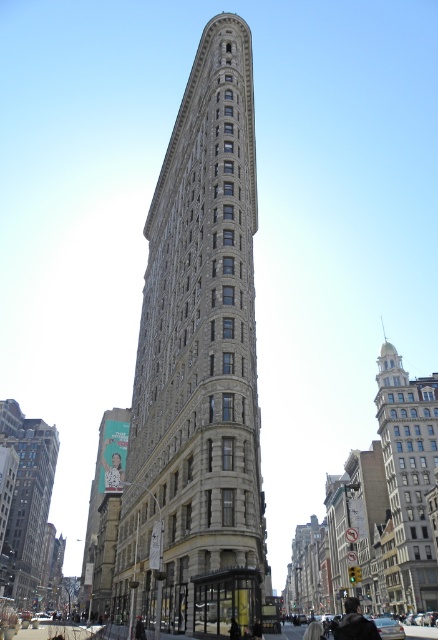
Question: Observing the image, what is the correct spatial positioning of stone textured building at center in reference to gray stone building at center?

Choices:
 (A) below
 (B) above

Answer: (B)

Question: Which of the following is the closest to the observer?

Choices:
 (A) (394, 605)
 (B) (154, 600)
 (C) (31, 600)

Answer: (B)

Question: Which object is the closest to the silver metallic building at right?

Choices:
 (A) stone textured building at center
 (B) gray stone building at center

Answer: (A)

Question: Can you confirm if stone textured building at center is positioned below gray stone building at center?

Choices:
 (A) no
 (B) yes

Answer: (A)

Question: Does stone textured building at center have a larger size compared to gray stone building at center?

Choices:
 (A) yes
 (B) no

Answer: (B)

Question: Which point is farther to the camera?

Choices:
 (A) stone textured building at center
 (B) gray stone building at center

Answer: (B)